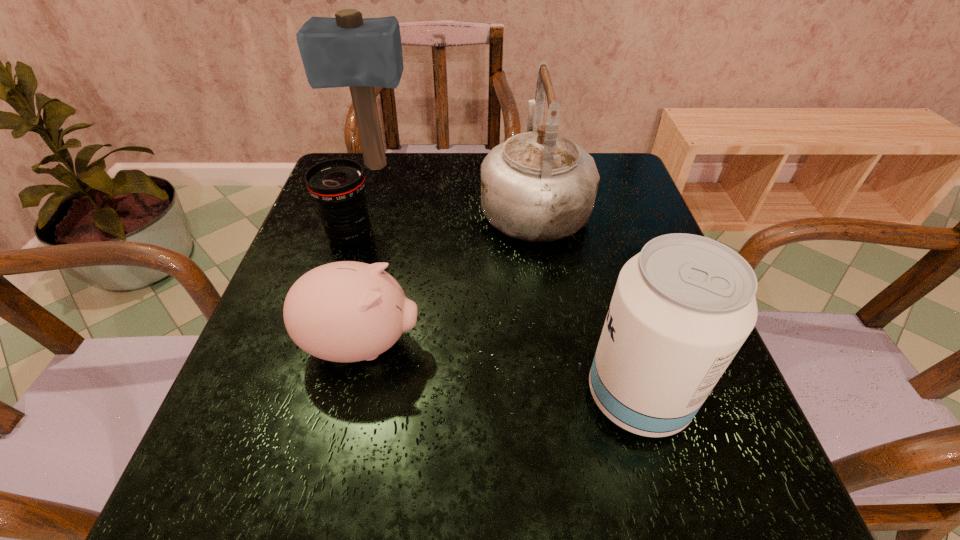
Where is `the tallest object`? Image resolution: width=960 pixels, height=540 pixels. the tallest object is located at coordinates (350, 51).

Identify the location of kettle. The height and width of the screenshot is (540, 960). (538, 186).

Where is `alcohol`? The width and height of the screenshot is (960, 540). alcohol is located at coordinates (682, 308).

Identify the location of piggy bank. (347, 311).

The image size is (960, 540). Identify the location of telephoto lens. (337, 185).

Locate an element on the screen. This screenshot has height=540, width=960. vacant space positioned 0.080m on the front of the tallest object is located at coordinates (366, 196).

Locate an element on the screen. The width and height of the screenshot is (960, 540). free space located 0.060m at the spout of the kettle is located at coordinates (527, 159).

Find the location of a particular element. This screenshot has width=960, height=540. free space located 0.070m at the spout of the kettle is located at coordinates (527, 157).

Where is `vacant space located 0.300m on the left of the alcohol`? Image resolution: width=960 pixels, height=540 pixels. vacant space located 0.300m on the left of the alcohol is located at coordinates (404, 396).

The width and height of the screenshot is (960, 540). I want to click on free spot located at the snout of the piggy bank, so click(x=549, y=345).